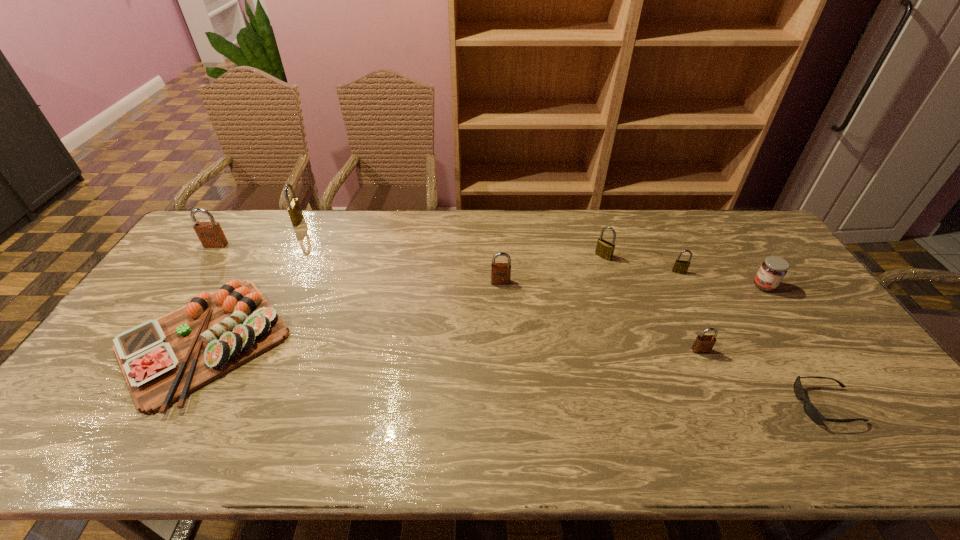
Identify which brass padlock is the nearest to the nearest brown padlock. Please provide its 2D coordinates. Your answer should be formatted as a tuple, i.e. [(x, y)], where the tuple contains the x and y coordinates of a point satisfying the conditions above.

[(681, 267)]

Locate which brass padlock is the closest to the nearest brown padlock. Please provide its 2D coordinates. Your answer should be formatted as a tuple, i.e. [(x, y)], where the tuple contains the x and y coordinates of a point satisfying the conditions above.

[(681, 267)]

Locate an element on the screen. brown padlock that is the second closest one to the sunglasses is located at coordinates (500, 272).

At what (x,y) coordinates should I click in order to perform the action: click on brown padlock that is the closest to the nearest brown padlock. Please return your answer as a coordinate pair (x, y). The width and height of the screenshot is (960, 540). Looking at the image, I should click on (500, 272).